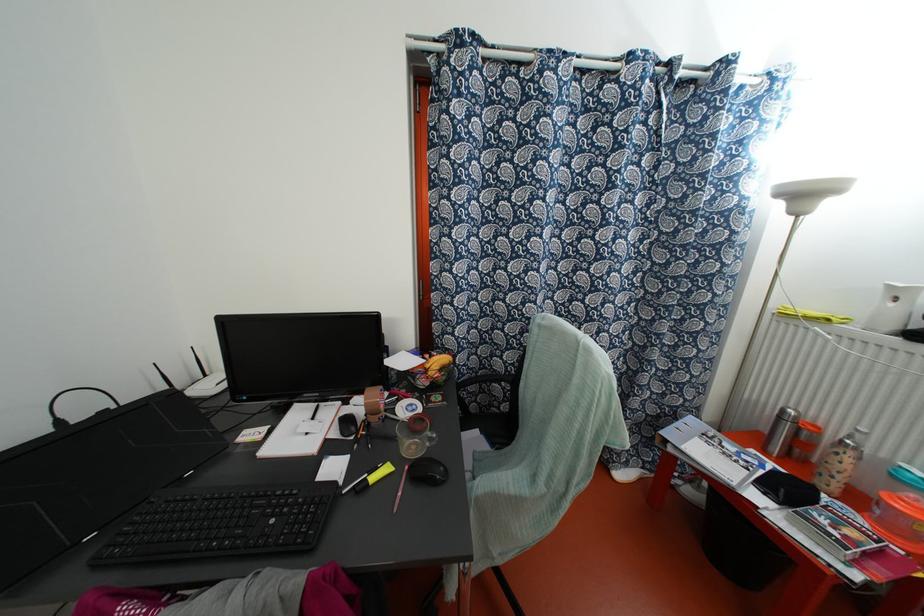
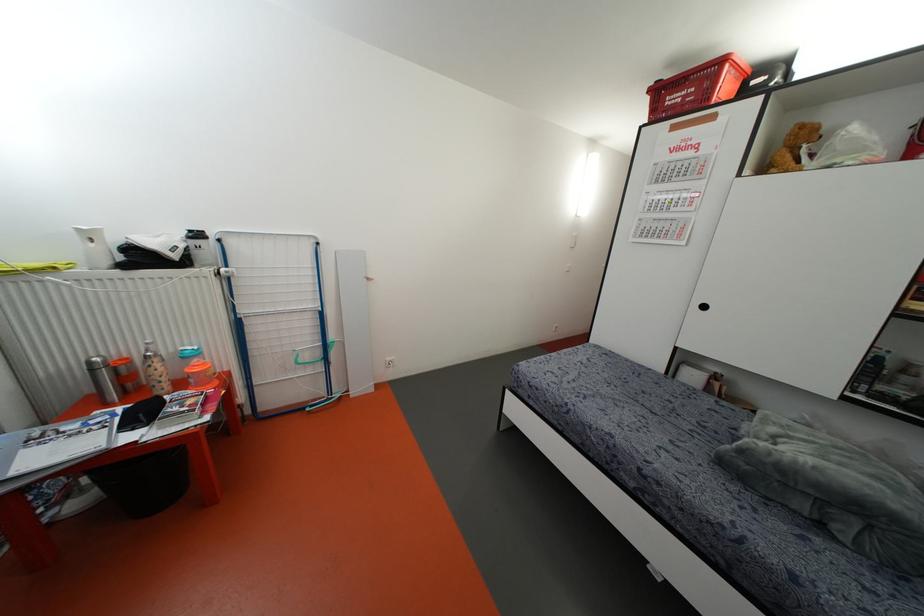
Locate, in the second image, the point that corresponds to point (850, 453) in the first image.

(155, 360)